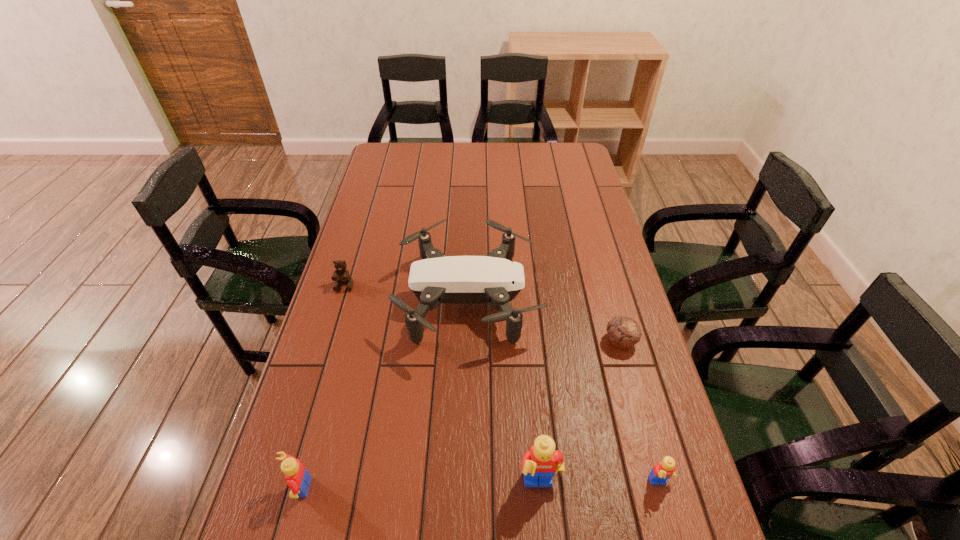
Image resolution: width=960 pixels, height=540 pixels. I want to click on free spot at the right edge of the desktop, so click(x=674, y=441).

Where is `free spot at the far left corner of the desktop`? Image resolution: width=960 pixels, height=540 pixels. free spot at the far left corner of the desktop is located at coordinates (411, 147).

This screenshot has height=540, width=960. In the image, there is a desktop. Identify the location of vacant space at the near right corner. (671, 510).

This screenshot has height=540, width=960. What are the coordinates of `vacant space that is in between the leftmost Lego and the teddy bear` in the screenshot? It's located at (322, 387).

Find the location of `vacant point located between the shortest Lego and the teddy bear`. vacant point located between the shortest Lego and the teddy bear is located at coordinates (502, 384).

At what (x,y) coordinates should I click in order to perform the action: click on vacant area that lies between the teddy bear and the second Lego from left to right. Please return your answer as a coordinate pair (x, y). Image resolution: width=960 pixels, height=540 pixels. Looking at the image, I should click on (443, 385).

Identify the location of unoccupied area between the tallest Lego and the drone. (504, 392).

Identify the location of free space between the teddy bear and the second Lego from right to left. This screenshot has width=960, height=540. (443, 385).

This screenshot has width=960, height=540. Find the location of `free space between the drone and the muffin`. free space between the drone and the muffin is located at coordinates (544, 320).

Find the location of a particular element. The image size is (960, 540). free spot between the teddy bear and the drone is located at coordinates (407, 292).